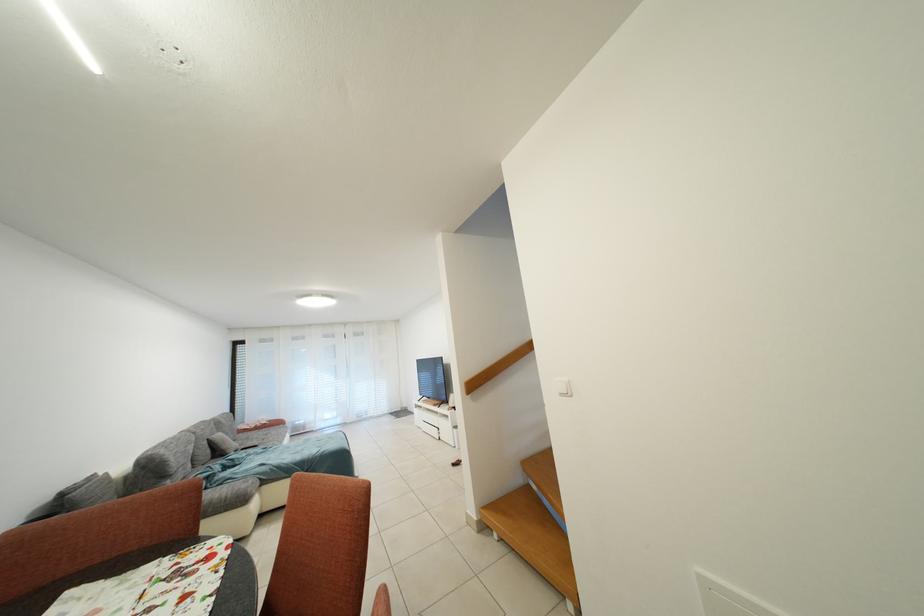
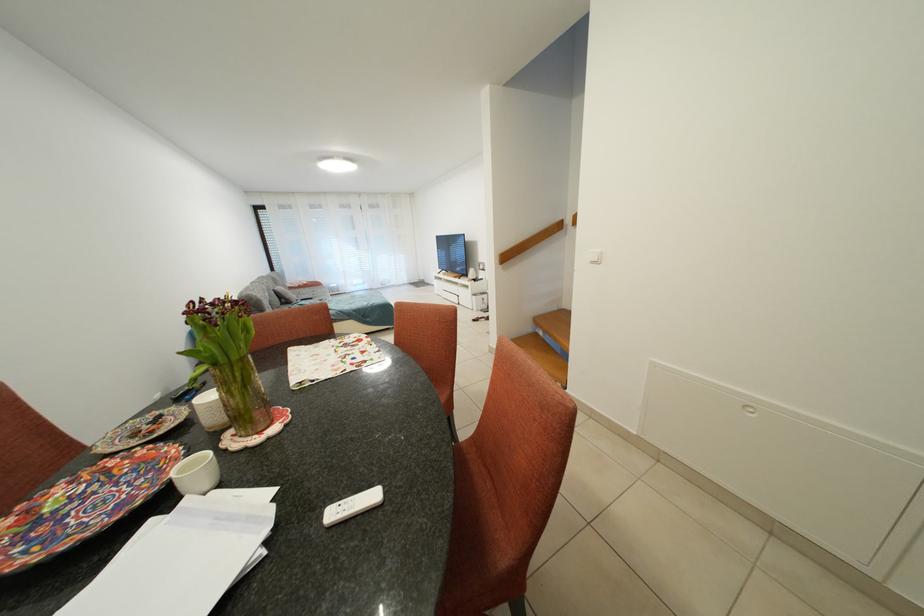
In the second image, find the point that corresponds to (346,424) in the first image.

(373, 291)